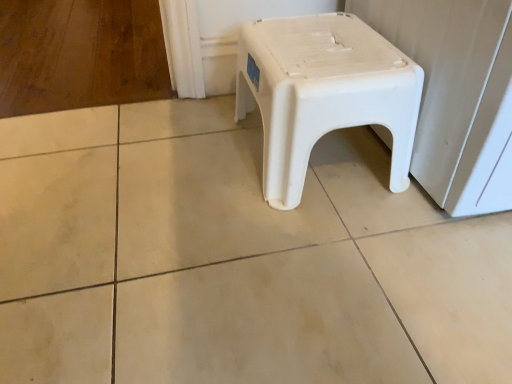
Identify the location of vacant area that is in front of white plastic stool at center. This screenshot has height=384, width=512. (329, 256).